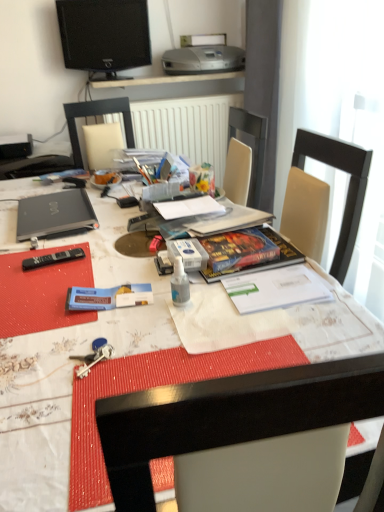
This screenshot has height=512, width=384. Find the location of `vacant space behind black plastic remote control at lower left`. vacant space behind black plastic remote control at lower left is located at coordinates (71, 241).